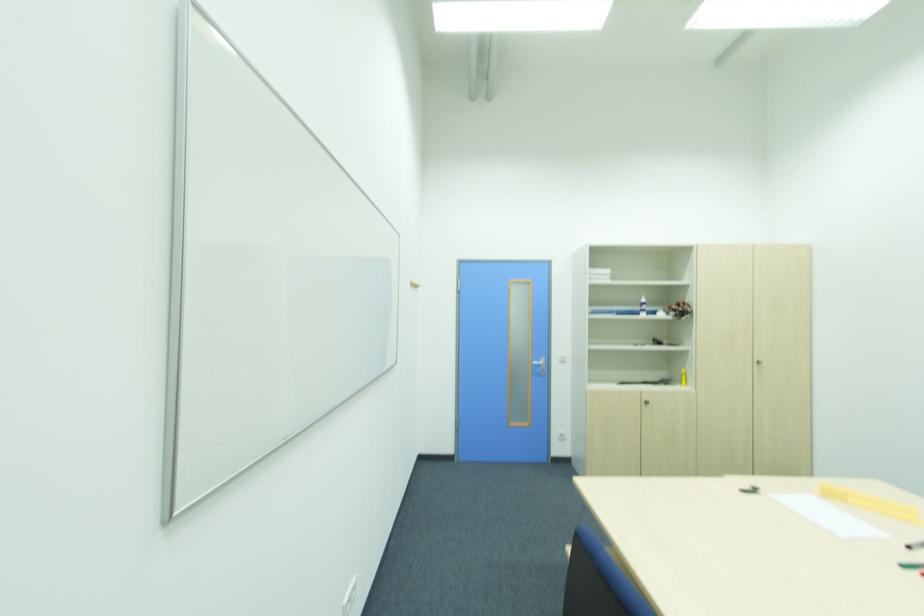
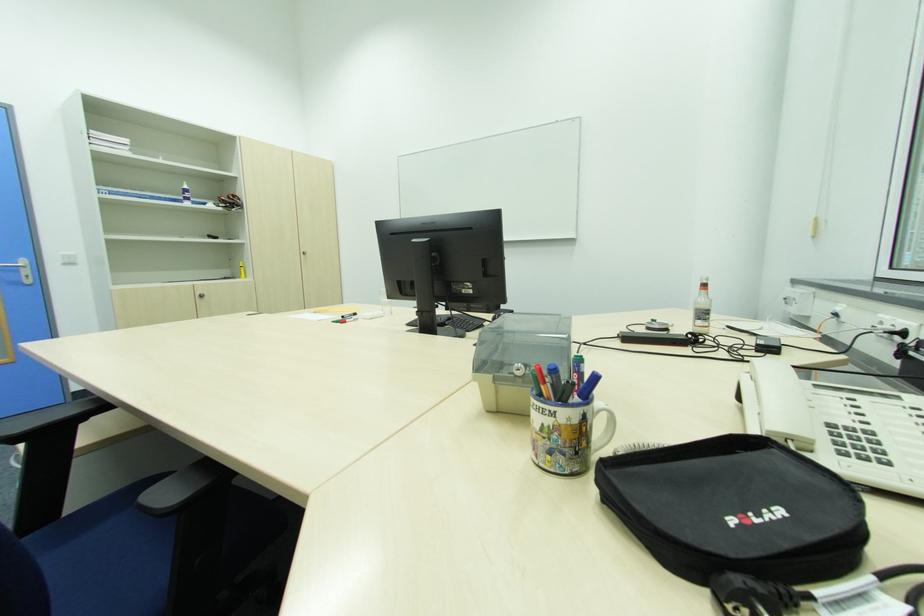
Question: Based on the continuous images, in which direction is the camera rotating? Reply with the corresponding letter.

Choices:
 (A) Left
 (B) Right
 (C) Up
 (D) Down

Answer: (B)